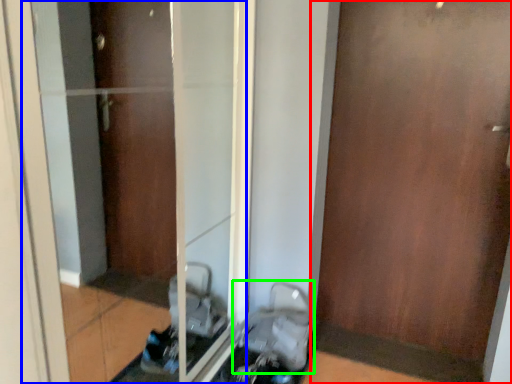
Question: Which is nearer to the door (highlighted by a red box)? glass door (highlighted by a blue box) or baby carriage (highlighted by a green box).

Choices:
 (A) glass door
 (B) baby carriage

Answer: (B)